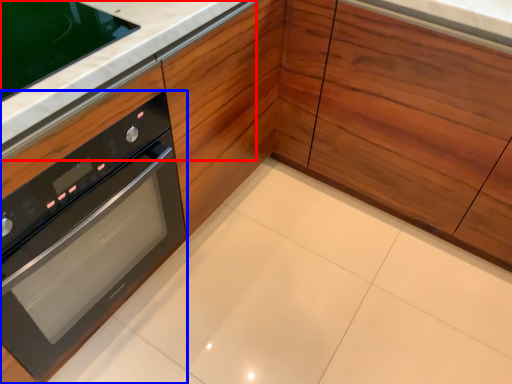
Question: Among these objects, which one is nearest to the camera, counter top (highlighted by a red box) or oven (highlighted by a blue box)?

Choices:
 (A) counter top
 (B) oven

Answer: (B)